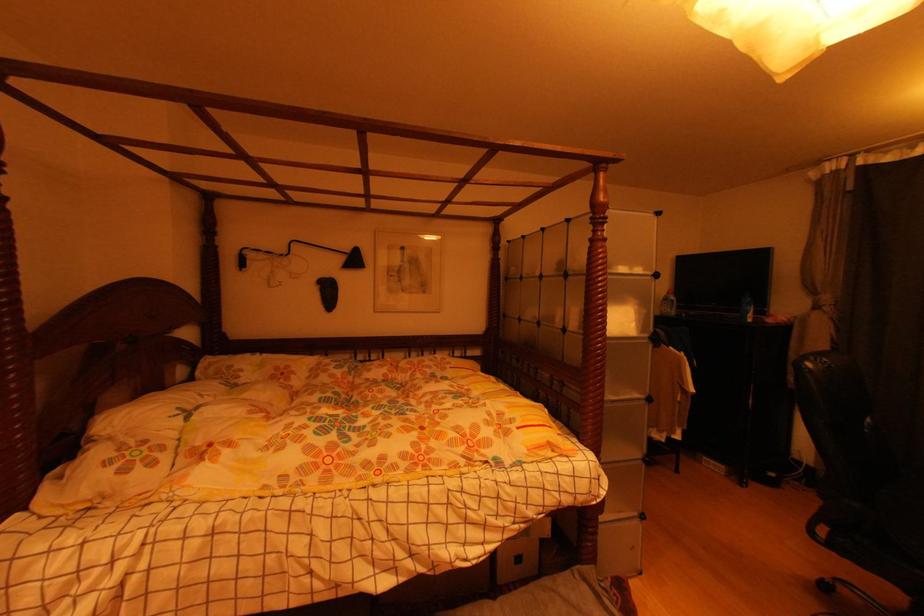
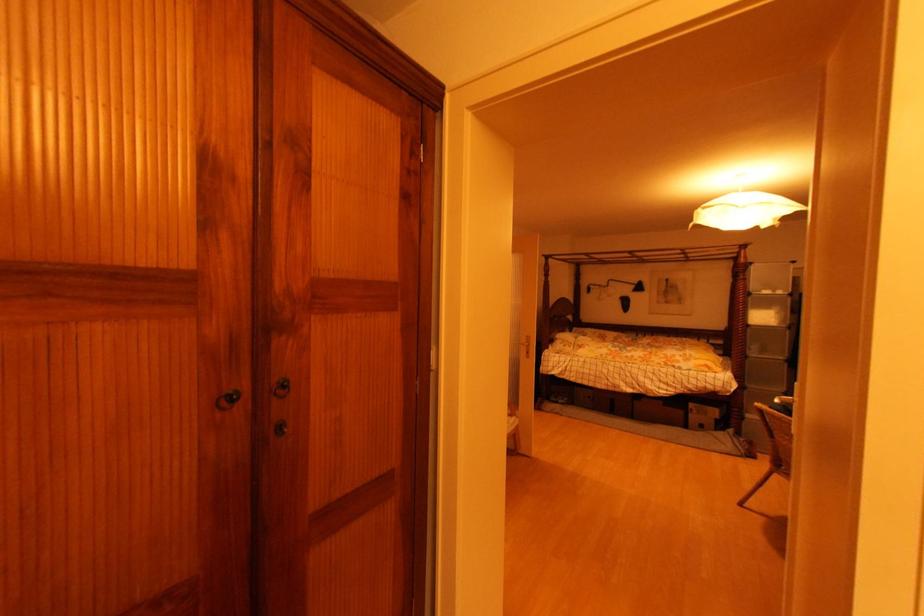
The point at [642,272] is marked in the first image. Where is the corresponding point in the second image?

(784, 294)